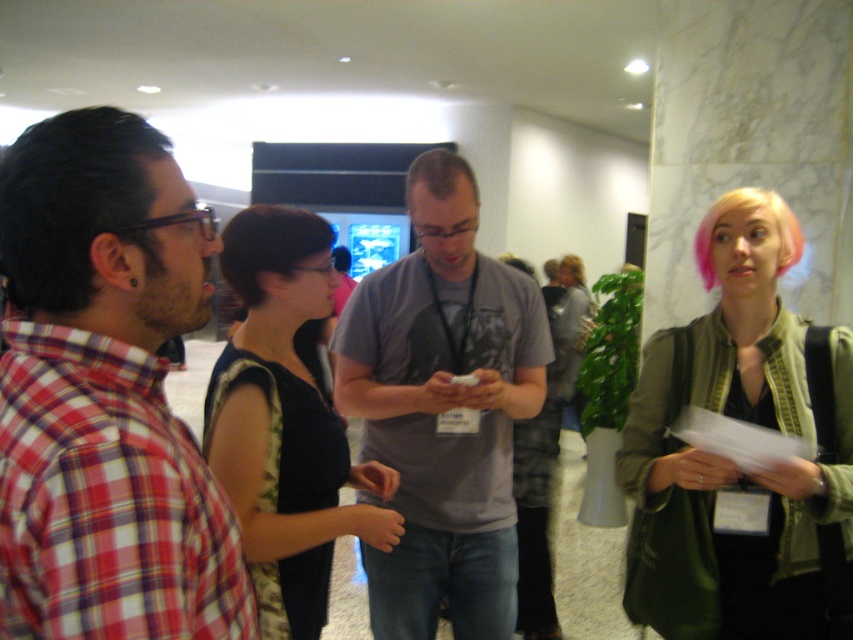
You are a photographer at this event and want to take a photo of both the brown matte hair at center and the pink matte hair at upper right without any obstruction. Based on their positions, which one should you focus on first to ensure both are visible?

The brown matte hair at center is in front of the pink matte hair at upper right, so you should focus on the pink matte hair at upper right first to ensure both are visible without obstruction.